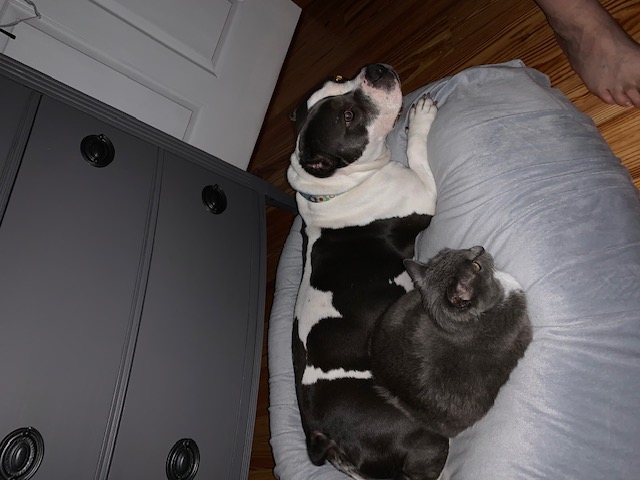
Find the location of a particular element. This screenshot has width=640, height=480. pet bed is located at coordinates (390, 362).